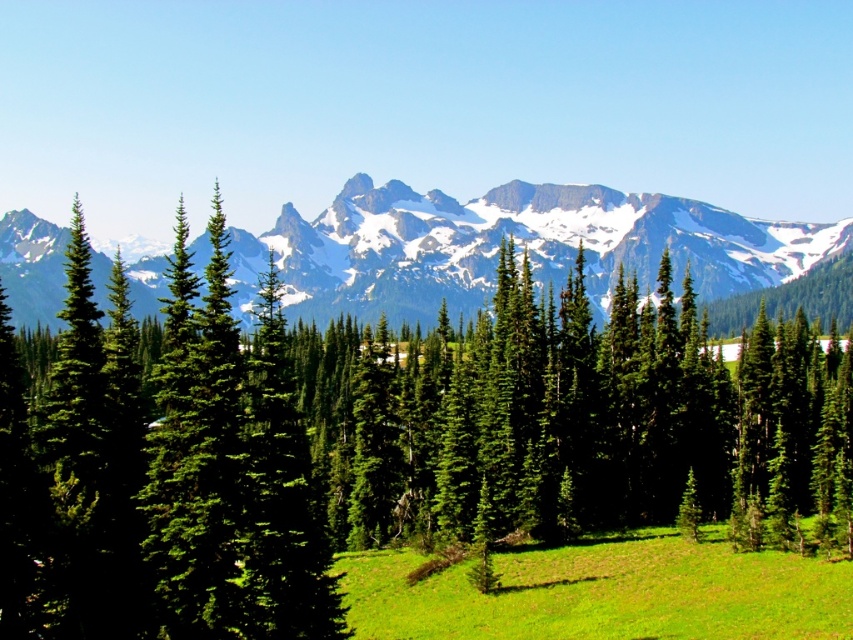
Question: Can you confirm if green matte tree at center is bigger than green grassy field at center?

Choices:
 (A) yes
 (B) no

Answer: (A)

Question: Which of these objects is positioned closest to the green matte tree at center?

Choices:
 (A) snowy granite mountain range at upper center
 (B) green matte evergreen tree at center

Answer: (B)

Question: Which of the following is the closest to the observer?

Choices:
 (A) (799, 596)
 (B) (668, 502)

Answer: (A)

Question: Based on their relative distances, which object is nearer to the green matte evergreen tree at center?

Choices:
 (A) snowy granite mountain range at upper center
 (B) green matte tree at center

Answer: (B)

Question: Considering the relative positions of green matte tree at center and green matte evergreen tree at center in the image provided, where is green matte tree at center located with respect to green matte evergreen tree at center?

Choices:
 (A) right
 (B) left

Answer: (A)

Question: Can you confirm if snowy granite mountain range at upper center is bigger than green grassy field at center?

Choices:
 (A) yes
 (B) no

Answer: (A)